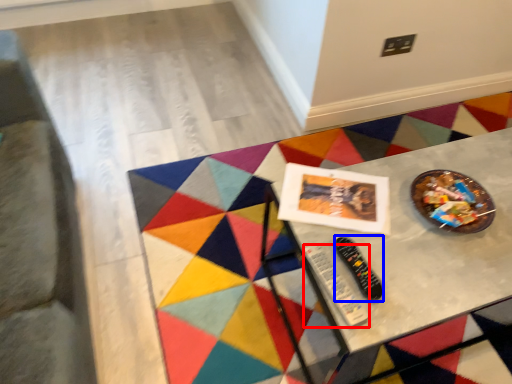
Question: Which point is closer to the camera, control (highlighted by a red box) or control (highlighted by a blue box)?

Choices:
 (A) control
 (B) control

Answer: (A)